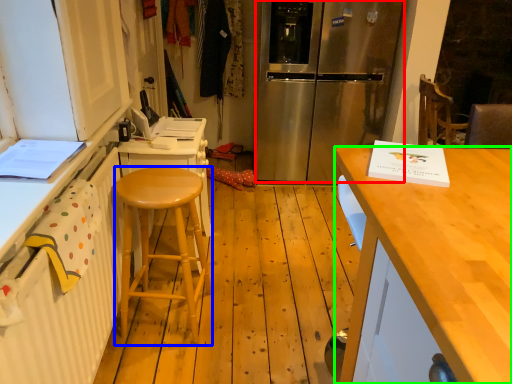
Question: Estimate the real-world distances between objects in this image. Which object is closer to refrigerator (highlighted by a red box), stool (highlighted by a blue box) or desk (highlighted by a green box)?

Choices:
 (A) stool
 (B) desk

Answer: (A)